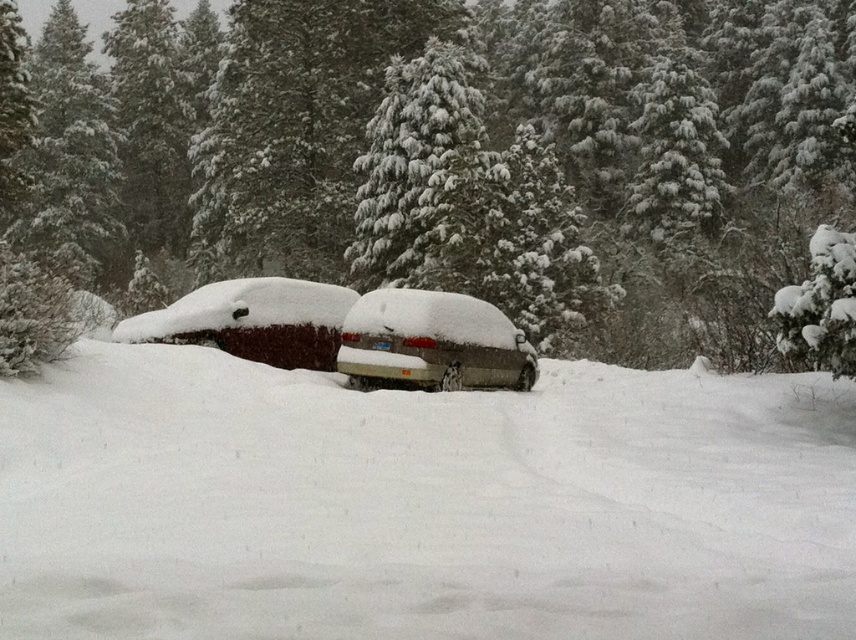
Locate an element on the screen. white fluffy snow at center is located at coordinates (421, 502).

From the picture: Is white fluffy snow at center to the right of snow-covered sedan at center from the viewer's perspective?

In fact, white fluffy snow at center is to the left of snow-covered sedan at center.

The height and width of the screenshot is (640, 856). What do you see at coordinates (421, 502) in the screenshot? I see `white fluffy snow at center` at bounding box center [421, 502].

Locate an element on the screen. Image resolution: width=856 pixels, height=640 pixels. white fluffy snow at center is located at coordinates (421, 502).

Who is positioned more to the left, snow-covered evergreen tree at center or white fluffy snow at center?

snow-covered evergreen tree at center is more to the left.

Can you confirm if snow-covered evergreen tree at center is positioned to the left of white fluffy snow at center?

Indeed, snow-covered evergreen tree at center is positioned on the left side of white fluffy snow at center.

At what (x,y) coordinates should I click in order to perform the action: click on snow-covered evergreen tree at center. Please return your answer as a coordinate pair (x, y). The image size is (856, 640). Looking at the image, I should click on (464, 152).

Does snow-covered evergreen tree at center have a greater width compared to snow-covered sedan at center?

Correct, the width of snow-covered evergreen tree at center exceeds that of snow-covered sedan at center.

Between snow-covered evergreen tree at center and snow-covered sedan at center, which one is positioned lower?

snow-covered sedan at center is below.

Is point (229, 188) in front of point (401, 371)?

No.

This screenshot has height=640, width=856. Identify the location of snow-covered evergreen tree at center. (464, 152).